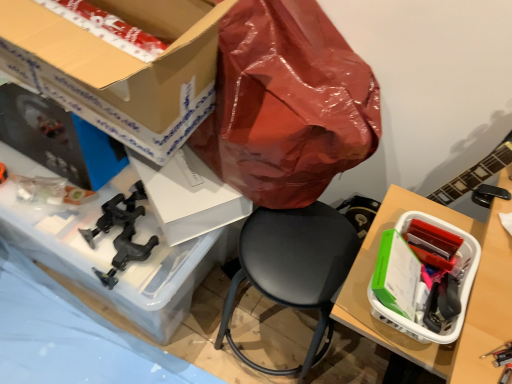
Identify the location of vacant area on top of white plastic basket at right, which is the 2th box in top-to-bottom order (from a real-world perspective). Image resolution: width=512 pixels, height=384 pixels. (419, 249).